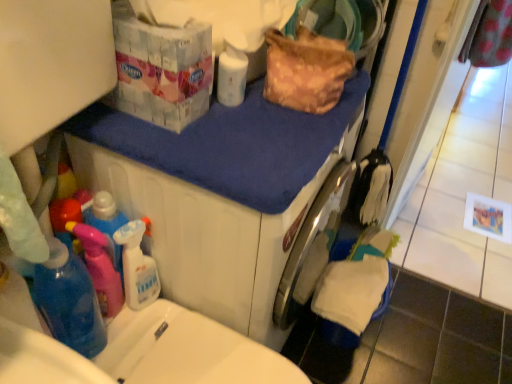
Question: From the image's perspective, is blue fabric at upper center positioned above or below white glossy bottle at upper center?

Choices:
 (A) above
 (B) below

Answer: (B)

Question: Relative to white glossy bottle at upper center, is blue fabric at upper center in front or behind?

Choices:
 (A) behind
 (B) front

Answer: (B)

Question: Considering the positions of blue fabric at upper center and white glossy bottle at upper center in the image, is blue fabric at upper center wider or thinner than white glossy bottle at upper center?

Choices:
 (A) thin
 (B) wide

Answer: (B)

Question: From the image's perspective, is white glossy bottle at upper center above or below blue fabric at upper center?

Choices:
 (A) below
 (B) above

Answer: (B)

Question: Is white glossy bottle at upper center bigger or smaller than blue fabric at upper center?

Choices:
 (A) big
 (B) small

Answer: (B)

Question: From a real-world perspective, is white glossy bottle at upper center positioned above or below blue fabric at upper center?

Choices:
 (A) below
 (B) above

Answer: (B)

Question: Is white glossy bottle at upper center in front of or behind blue fabric at upper center in the image?

Choices:
 (A) front
 (B) behind

Answer: (B)